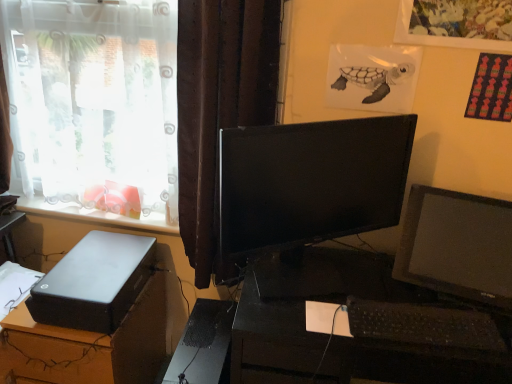
Question: Is satin black desktop at lower left, which is counted as the first desk, starting from the left, at the right side of black matte computer tower at lower left?

Choices:
 (A) yes
 (B) no

Answer: (B)

Question: Is satin black desktop at lower left, which is counted as the first desk, starting from the left, facing away from black matte computer tower at lower left?

Choices:
 (A) yes
 (B) no

Answer: (B)

Question: Are satin black desktop at lower left, which is counted as the 2th desk, starting from the right, and black matte computer tower at lower left making contact?

Choices:
 (A) yes
 (B) no

Answer: (B)

Question: Can you confirm if satin black desktop at lower left, which is counted as the 2th desk, starting from the right, is taller than black matte computer tower at lower left?

Choices:
 (A) yes
 (B) no

Answer: (A)

Question: From a real-world perspective, does satin black desktop at lower left, which is counted as the 2th desk, starting from the right, stand above black matte computer tower at lower left?

Choices:
 (A) no
 (B) yes

Answer: (B)

Question: Is satin black desktop at lower left, which is counted as the first desk, starting from the left, smaller than black matte computer tower at lower left?

Choices:
 (A) no
 (B) yes

Answer: (A)

Question: Does black glossy monitor at center come in front of matte black hard drive at lower left?

Choices:
 (A) no
 (B) yes

Answer: (B)

Question: From the image's perspective, is black glossy monitor at center located above matte black hard drive at lower left?

Choices:
 (A) no
 (B) yes

Answer: (B)

Question: From a real-world perspective, is black glossy monitor at center physically above matte black hard drive at lower left?

Choices:
 (A) no
 (B) yes

Answer: (B)

Question: Would you say matte black hard drive at lower left is part of black glossy monitor at center's contents?

Choices:
 (A) yes
 (B) no

Answer: (B)

Question: Does black glossy monitor at center appear on the right side of matte black hard drive at lower left?

Choices:
 (A) yes
 (B) no

Answer: (A)

Question: Is black glossy monitor at center positioned with its back to matte black hard drive at lower left?

Choices:
 (A) yes
 (B) no

Answer: (B)

Question: From a real-world perspective, is black matte computer tower at lower left on top of white plastic window sill at lower left?

Choices:
 (A) no
 (B) yes

Answer: (A)